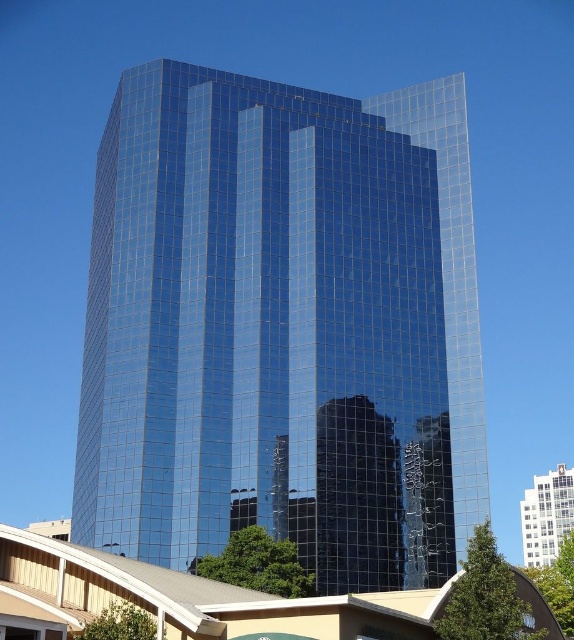
Question: Can you confirm if glossy glass tower at center is bigger than white glossy building at upper center?

Choices:
 (A) yes
 (B) no

Answer: (A)

Question: Which point is farther to the camera?

Choices:
 (A) [238, 150]
 (B) [528, 515]

Answer: (B)

Question: Which of the following is the closest to the observer?

Choices:
 (A) (557, 532)
 (B) (443, 244)

Answer: (B)

Question: Which of the following is the closest to the observer?

Choices:
 (A) glossy glass tower at center
 (B) white glossy building at upper center

Answer: (A)

Question: Where is glossy glass tower at center located in relation to white glossy building at upper center in the image?

Choices:
 (A) below
 (B) above

Answer: (B)

Question: Does glossy glass tower at center have a greater width compared to white glossy building at upper center?

Choices:
 (A) yes
 (B) no

Answer: (A)